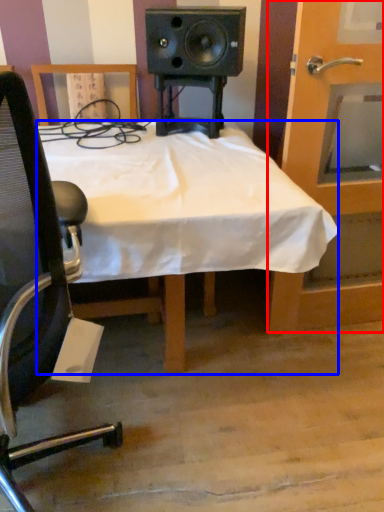
Question: Which point is closer to the camera, door (highlighted by a red box) or desk (highlighted by a blue box)?

Choices:
 (A) door
 (B) desk

Answer: (B)